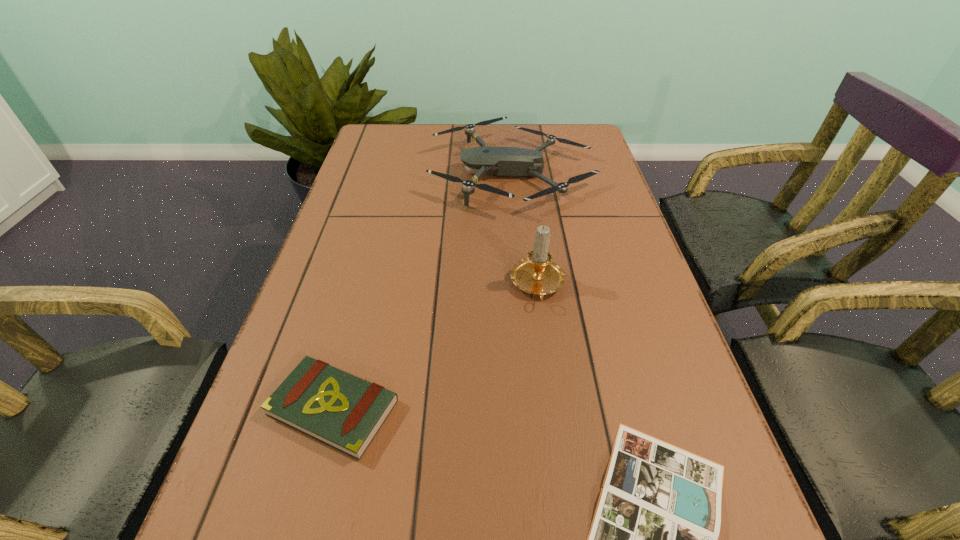
Where is `blank area located 0.310m on the back of the left book`? blank area located 0.310m on the back of the left book is located at coordinates (374, 252).

Identify the location of object that is at the far edge. This screenshot has height=540, width=960. [498, 161].

You are a GUI agent. You are given a task and a screenshot of the screen. Output one action in this format:
    pyautogui.click(x=<x>, y=<y>)
    Task: Click on the object that is at the left edge
    Image resolution: width=960 pixels, height=540 pixels.
    Given the screenshot: What is the action you would take?
    pyautogui.click(x=345, y=412)

Locate an element on the screen. This screenshot has width=960, height=540. object at the right edge is located at coordinates (498, 161).

You are a GUI agent. You are given a task and a screenshot of the screen. Output one action in this format:
    pyautogui.click(x=<x>, y=<y>)
    Task: Click on the object at the far right corner
    
    Given the screenshot: What is the action you would take?
    pyautogui.click(x=498, y=161)

Locate an element on the screen. Image resolution: width=960 pixels, height=540 pixels. free location at the far edge of the desktop is located at coordinates (420, 128).

You are a GUI agent. You are given a task and a screenshot of the screen. Output one action in this format:
    pyautogui.click(x=<x>, y=<y>)
    Task: Click on the vacant space at the left edge of the desktop
    This screenshot has height=540, width=960.
    Given the screenshot: What is the action you would take?
    pyautogui.click(x=317, y=538)

Locate an element on the screen. blank space at the right edge is located at coordinates (589, 197).

Locate an element on the screen. Image resolution: width=960 pixels, height=540 pixels. vacant space at the far right corner of the desktop is located at coordinates (595, 143).

The height and width of the screenshot is (540, 960). I want to click on empty space between the farthest object and the tallest object, so click(525, 230).